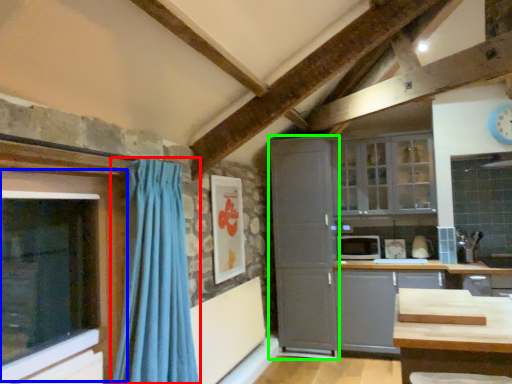
Question: Which object is positioned farthest from curtain (highlighted by a red box)? Select from window (highlighted by a blue box) and cabinetry (highlighted by a green box).

Choices:
 (A) window
 (B) cabinetry

Answer: (B)